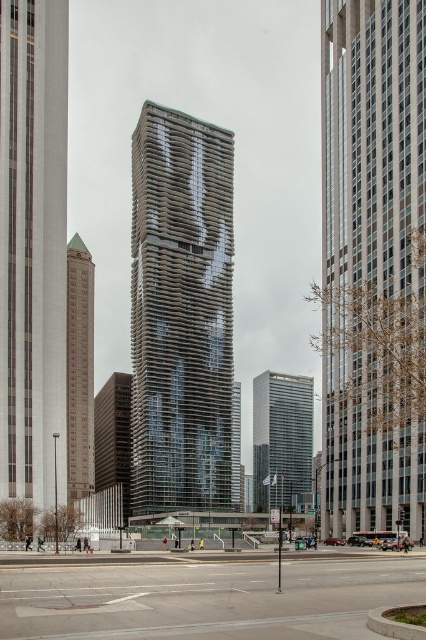
Does point (379, 378) lie in front of point (94, 276)?

That is True.

Does glassy reflective skyscraper at center have a lesser height compared to brown brick building at left?

No, glassy reflective skyscraper at center is not shorter than brown brick building at left.

Is point (414, 308) positioned in front of point (92, 321)?

Yes, point (414, 308) is closer to viewer.

Where is `glassy reflective skyscraper at center`? glassy reflective skyscraper at center is located at coordinates (373, 262).

Who is positioned more to the left, smooth white skyscraper at left or dark gray concrete building at center?

dark gray concrete building at center is more to the left.

Which is in front, point (60, 305) or point (103, 435)?

Positioned in front is point (60, 305).

Describe the element at coordinates (32, 248) in the screenshot. The width and height of the screenshot is (426, 640). I see `smooth white skyscraper at left` at that location.

You are a GUI agent. You are given a task and a screenshot of the screen. Output one action in this format:
    pyautogui.click(x=<x>, y=<y>)
    Task: Click on the smooth white skyscraper at left
    
    Given the screenshot: What is the action you would take?
    pyautogui.click(x=32, y=248)

Who is more distant from viewer, (219, 397) or (262, 387)?

Point (262, 387)

Is point (210, 182) farther from camera compared to point (253, 380)?

No, (210, 182) is in front of (253, 380).

This screenshot has width=426, height=640. Describe the element at coordinates (181, 312) in the screenshot. I see `glassy metallic tower at center` at that location.

I want to click on glassy metallic tower at center, so click(x=181, y=312).